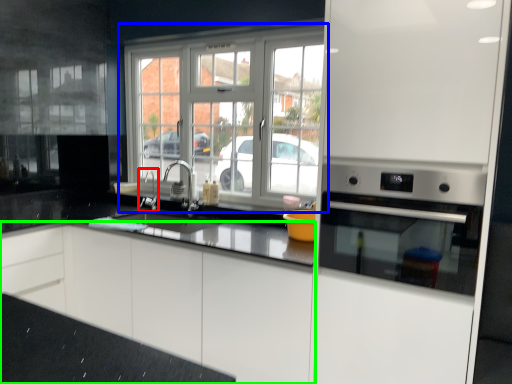
Question: Which object is the farthest from faucet (highlighted by a red box)? Choose among these: window (highlighted by a blue box) or cabinetry (highlighted by a green box).

Choices:
 (A) window
 (B) cabinetry

Answer: (B)